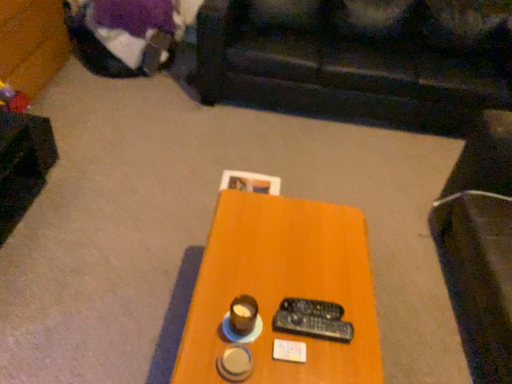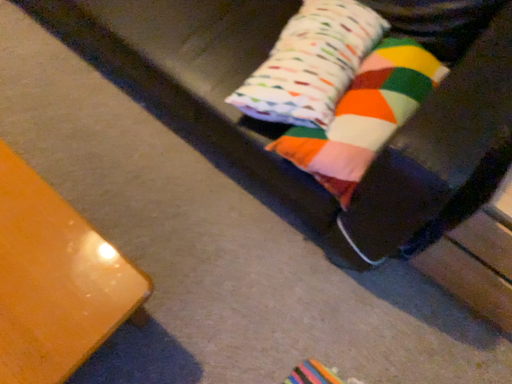
Question: Which way did the camera rotate in the video?

Choices:
 (A) rotated upward
 (B) rotated downward

Answer: (B)